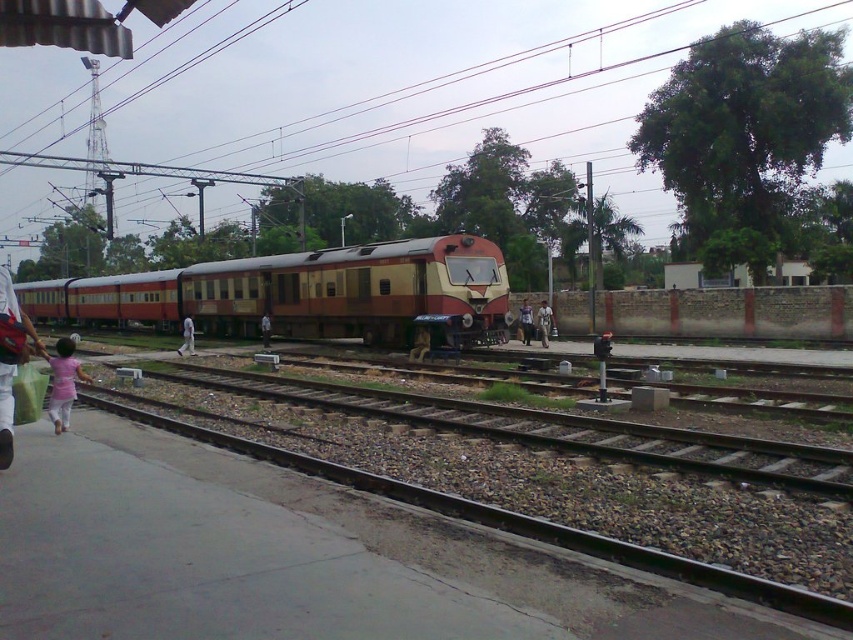
You are a maintenance worker needing to reach the metallic wires at upper center from the smooth brown jacket at center. Considering the distance between them is 322.13 feet, can you estimate how long it would take to walk there at an average walking speed of 3 feet per second?

The metallic wires at upper center is 322.13 feet away from the smooth brown jacket at center. Dividing the distance by the walking speed of 3 feet per second gives approximately 107.38 seconds, which is roughly 1 minute and 47 seconds.

You are standing at the railway station and see the train. There is a specific point marked as point (437, 88). What object does this point correspond to?

The point (437, 88) corresponds to the metallic wires at upper center.